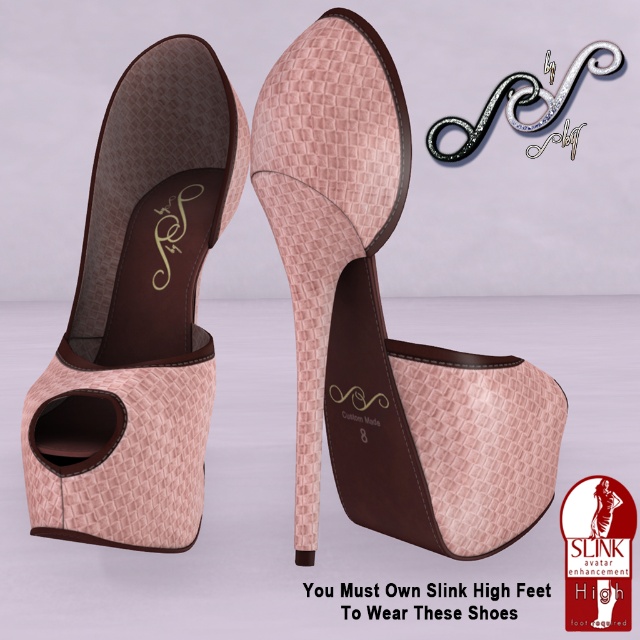
You are an avatar designer working on a virtual fashion project. You need to place a pink textured high heel at center in a specific position. What are the coordinates where you should place it?

The pink textured high heel at center should be placed at coordinates point (x=384, y=321).

You are an avatar trying to choose between the pink textured high heel at center and the pink woven leather sandal at left for a formal event. Which shoe is more visible in the image?

The pink textured high heel at center is more visible because the pink woven leather sandal at left is positioned behind it.

You are an avatar trying to reach a shelf that is 1 meter away from you. You see the pink textured high heel at center. Can you reach the shelf by stepping forward from where you are standing?

The pink textured high heel at center is 99.31 centimeters from viewer, so stepping forward would bring you closer. Since the shelf is 1 meter away, you can reach it by moving forward as the distance is just 0.69 cm less than the required distance.